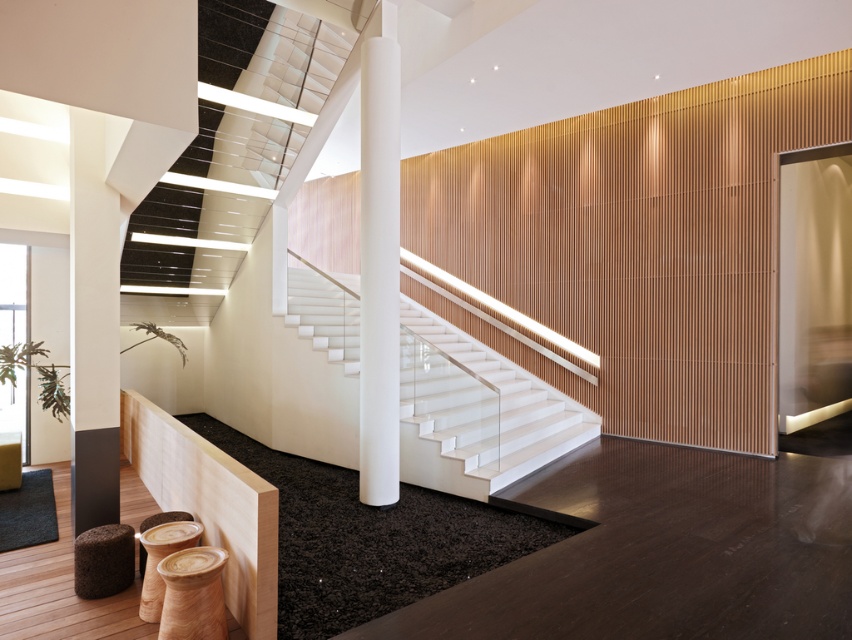
You are a maintenance worker needing to place a tool box on a surface at the lower left of the image. Which object between the natural wood balustrade at lower left and the brown fuzzy stool at lower left is taller and thus more suitable for placing the tool box?

The natural wood balustrade at lower left is taller than the brown fuzzy stool at lower left, so it is more suitable for placing the tool box.

You are a delivery person entering the space and need to place a package on the wooden textured stool at lower left. Can you easily access it without moving the white glossy column at center?

The white glossy column at center is located above the wooden textured stool at lower left, so the column is blocking direct access to the stool. You would need to move the column to reach the stool, but since columns are typically structural, this might not be feasible. Consider placing the package elsewhere or alerting the recipient about the accessibility issue.

You are a delivery person trying to move a large box through the space. You notice the natural wood balustrade at lower left and the brown fuzzy stool at lower left. Which object has a greater width, and why is this important for navigating with your box?

The natural wood balustrade at lower left has a greater width than the brown fuzzy stool at lower left. This is important because the wider balustrade may restrict the path for maneuvering the large box, requiring careful navigation around it to avoid collisions.